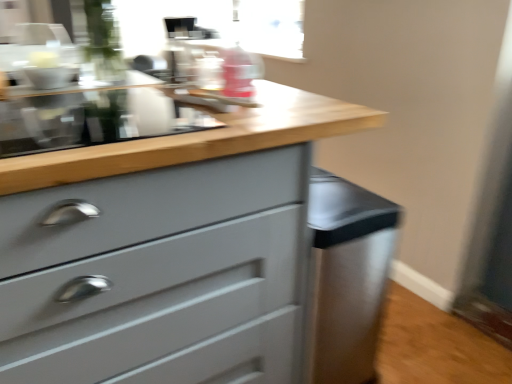
Question: Should I look upward or downward to see satin silver cabinet at lower right?

Choices:
 (A) down
 (B) up

Answer: (A)

Question: Does satin silver cabinet at lower right have a smaller size compared to matte gray chest of drawers at center?

Choices:
 (A) yes
 (B) no

Answer: (A)

Question: Can you confirm if satin silver cabinet at lower right is shorter than matte gray chest of drawers at center?

Choices:
 (A) no
 (B) yes

Answer: (B)

Question: Does satin silver cabinet at lower right have a larger size compared to matte gray chest of drawers at center?

Choices:
 (A) yes
 (B) no

Answer: (B)

Question: Is satin silver cabinet at lower right to the right of matte gray chest of drawers at center from the viewer's perspective?

Choices:
 (A) yes
 (B) no

Answer: (A)

Question: Is satin silver cabinet at lower right facing towards matte gray chest of drawers at center?

Choices:
 (A) no
 (B) yes

Answer: (B)

Question: From the image's perspective, is satin silver cabinet at lower right located above matte gray chest of drawers at center?

Choices:
 (A) no
 (B) yes

Answer: (A)

Question: Could satin silver cabinet at lower right be considered to be inside matte gray chest of drawers at center?

Choices:
 (A) no
 (B) yes

Answer: (B)

Question: Is matte gray chest of drawers at center next to satin silver cabinet at lower right?

Choices:
 (A) yes
 (B) no

Answer: (B)

Question: Is matte gray chest of drawers at center at the right side of satin silver cabinet at lower right?

Choices:
 (A) yes
 (B) no

Answer: (B)

Question: Does matte gray chest of drawers at center lie in front of satin silver cabinet at lower right?

Choices:
 (A) no
 (B) yes

Answer: (B)

Question: Does matte gray chest of drawers at center turn towards satin silver cabinet at lower right?

Choices:
 (A) yes
 (B) no

Answer: (B)

Question: Can you confirm if matte gray chest of drawers at center is positioned to the left of satin silver cabinet at lower right?

Choices:
 (A) yes
 (B) no

Answer: (A)

Question: Looking at the image, does satin silver cabinet at lower right seem bigger or smaller compared to matte gray chest of drawers at center?

Choices:
 (A) big
 (B) small

Answer: (B)